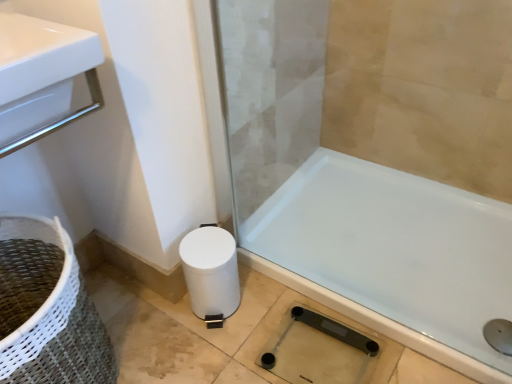
Identify the location of free spot above transparent glass shower at lower right (from a real-world perspective). pos(327,343).